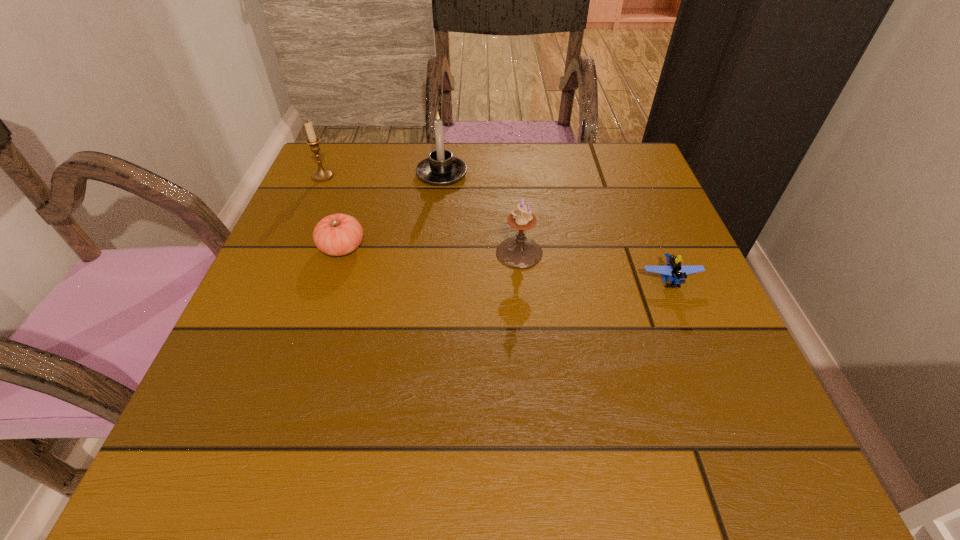
Find the location of a particular element. This screenshot has width=960, height=540. the second candle holder from right to left is located at coordinates (441, 168).

Identify the location of the leftmost object. This screenshot has width=960, height=540. (321, 175).

Image resolution: width=960 pixels, height=540 pixels. I want to click on the second object from right to left, so click(519, 252).

I want to click on the rightmost candle holder, so click(519, 252).

The width and height of the screenshot is (960, 540). I want to click on tomato, so click(339, 234).

You are a GUI agent. You are given a task and a screenshot of the screen. Output one action in this format:
    pyautogui.click(x=<x>, y=<y>)
    Task: Click on the Lego
    This screenshot has width=960, height=540.
    Given the screenshot: What is the action you would take?
    pyautogui.click(x=676, y=273)

I want to click on blank space located with a handle on the side of the third object from right to left, so click(444, 148).

Locate an element on the screen. Image resolution: width=960 pixels, height=540 pixels. vacant space situated 0.060m on the right of the leftmost object is located at coordinates (359, 176).

I want to click on free space located on the front of the fourth object from left to right, so click(533, 397).

This screenshot has height=540, width=960. In order to click on vacant space located 0.220m on the right of the tomato in this screenshot , I will do `click(475, 247)`.